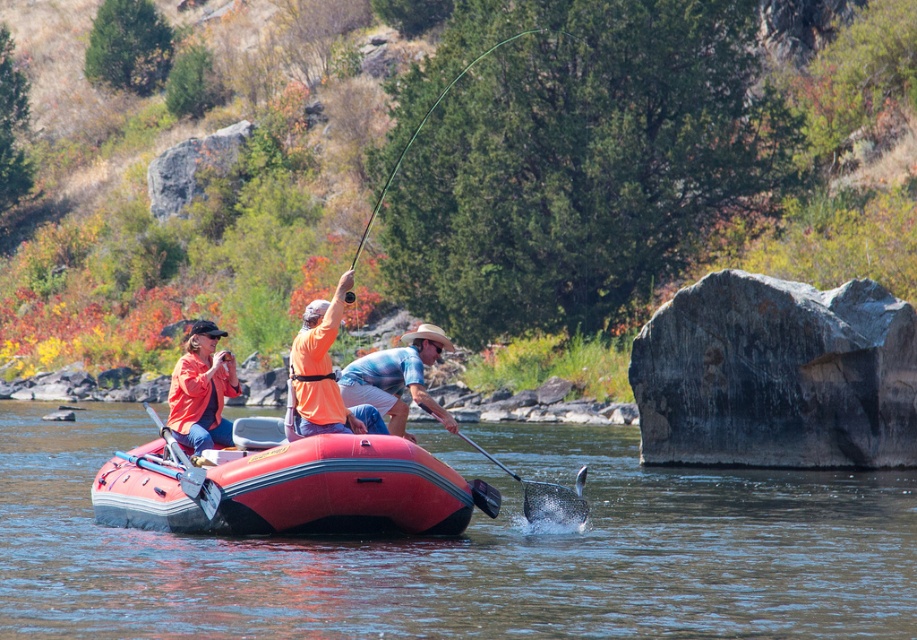
Who is more forward, [323,490] or [426,336]?

Positioned in front is point [323,490].

Between rubberized red raft at center and blue tie-dye shirt at center, which one is positioned lower?

rubberized red raft at center

Between point (188, 484) and point (377, 352), which one is positioned in front?

Positioned in front is point (188, 484).

Find the location of a particular element. The image size is (917, 640). rubberized red raft at center is located at coordinates (289, 490).

Image resolution: width=917 pixels, height=640 pixels. Describe the element at coordinates (466, 550) in the screenshot. I see `smooth rubber raft at center` at that location.

Can you confirm if smooth rubber raft at center is shorter than rubberized red raft at center?

In fact, smooth rubber raft at center may be taller than rubberized red raft at center.

Which is behind, point (159, 636) or point (230, 461)?

The point (230, 461) is behind.

Image resolution: width=917 pixels, height=640 pixels. Find the location of `smooth rubber raft at center`. smooth rubber raft at center is located at coordinates (466, 550).

Who is lower down, rubberized red raft at center or matte orange jacket at center?

rubberized red raft at center is below.

Describe the element at coordinates (289, 490) in the screenshot. I see `rubberized red raft at center` at that location.

What are the coordinates of `rubberized red raft at center` in the screenshot? It's located at (289, 490).